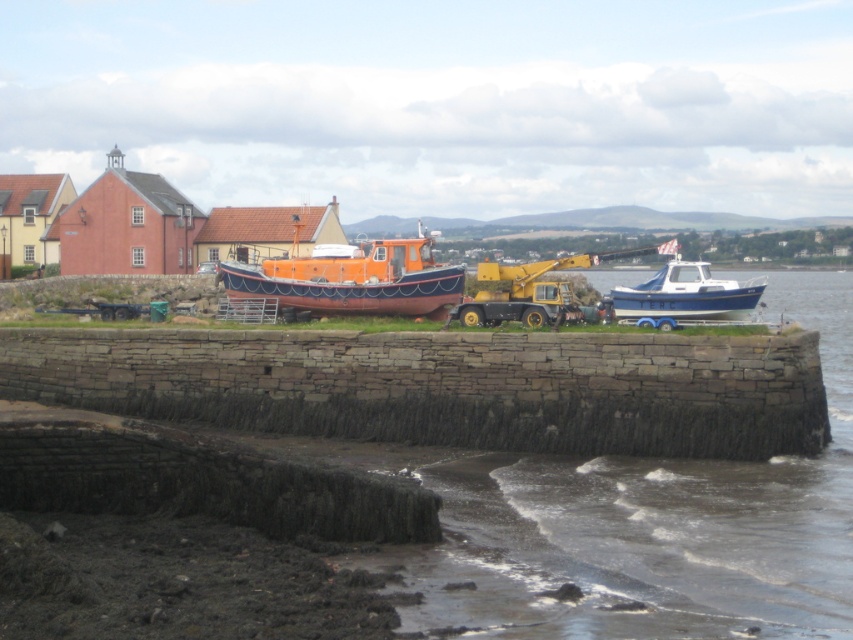
Does orange matte boat at center have a greater height compared to blue glossy boat at right?

Correct, orange matte boat at center is much taller as blue glossy boat at right.

Does orange matte boat at center have a smaller size compared to blue glossy boat at right?

No.

Between point (434, 284) and point (653, 301), which one is positioned in front?

Point (653, 301) is in front.

Locate an element on the screen. The height and width of the screenshot is (640, 853). orange matte boat at center is located at coordinates (352, 280).